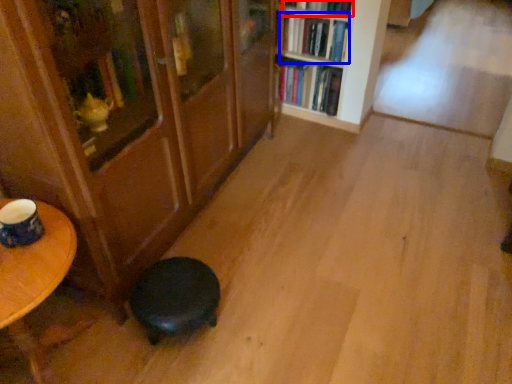
Question: Which object is further to the camera taking this photo, book (highlighted by a red box) or book (highlighted by a blue box)?

Choices:
 (A) book
 (B) book

Answer: (B)